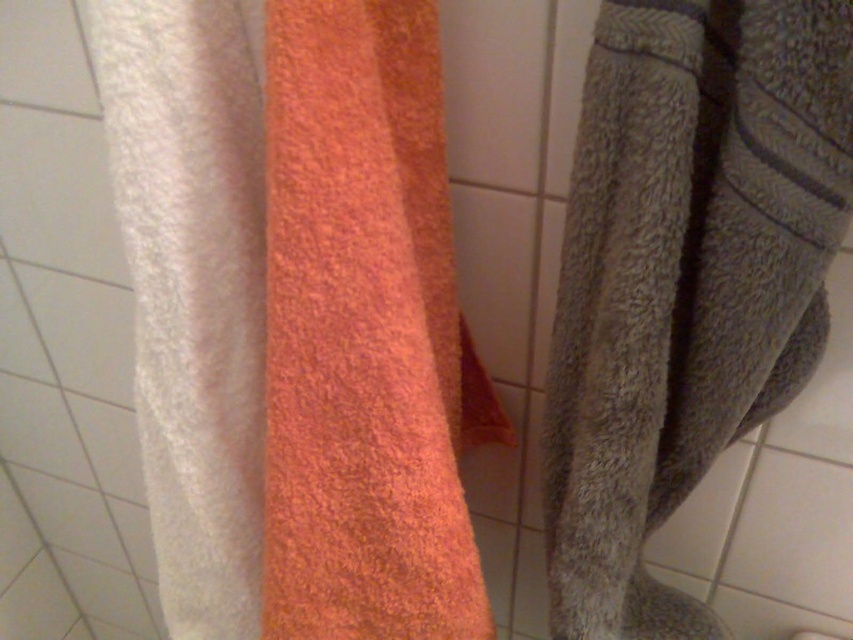
You are trying to determine if you can fit a small hand sanitizer bottle between the white fluffy towel at left and the gray textured towel at right. The bottle requires 12 centimeters of space to fit. Can you fit it?

The white fluffy towel at left is 14.15 centimeters away from the gray textured towel at right. Since 14.15 cm is greater than 12 cm, the hand sanitizer bottle can fit between them.

Looking at this image, you are packing a suitcase for a trip and want to know which towel will take up more vertical space when folded. Based on the image, which between the white fluffy towel at left and the gray textured towel at right is taller?

The white fluffy towel at left has a greater height compared to the gray textured towel at right, so it will take up more vertical space when folded.